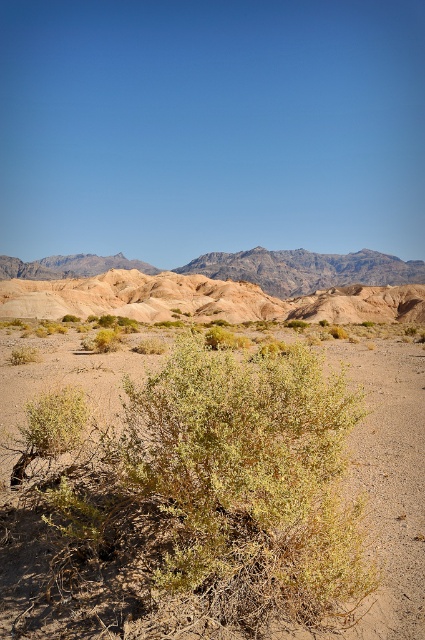
Question: Can you confirm if brown sandy bush at center is bigger than rugged sandstone mountain at upper center?

Choices:
 (A) no
 (B) yes

Answer: (A)

Question: Can you confirm if brown sandy bush at center is wider than rugged sandstone mountain at upper center?

Choices:
 (A) no
 (B) yes

Answer: (A)

Question: Does brown sandy bush at center lie in front of rugged sandstone mountain at upper center?

Choices:
 (A) no
 (B) yes

Answer: (B)

Question: Which object is farther from the camera taking this photo?

Choices:
 (A) rugged sandstone mountain at upper center
 (B) brown sandy bush at center

Answer: (A)

Question: Which object is farther from the camera taking this photo?

Choices:
 (A) rugged sandstone mountain at upper center
 (B) brown sandy bush at center

Answer: (A)